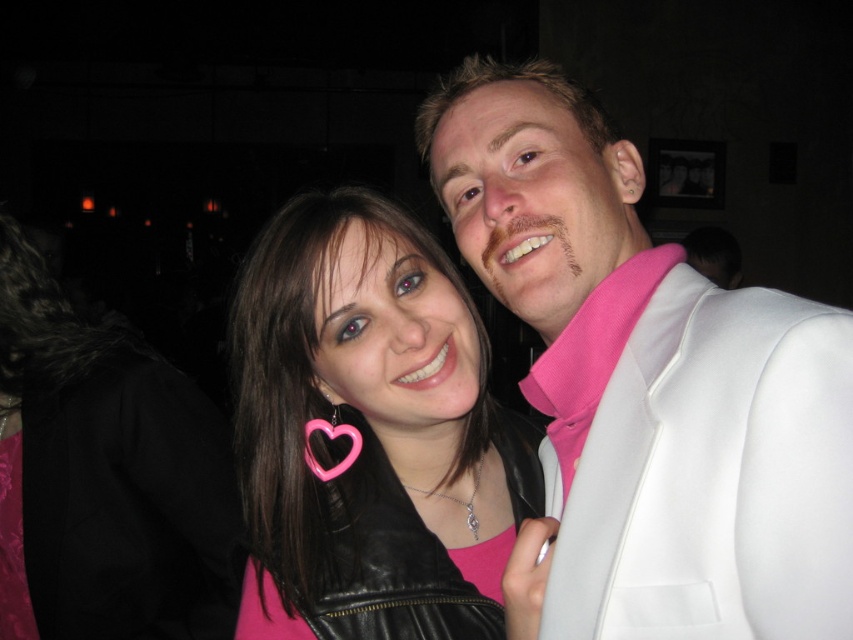
You are a photographer adjusting the lighting for the photo. The main light source is at position point A. To ensure the white satin suit at upper right is evenly lit, where should you place the light source relative to the suit?

The white satin suit at upper right is located at point [650,381]. To evenly light the suit, place the light source directly in front of it at a slight angle to avoid harsh shadows.